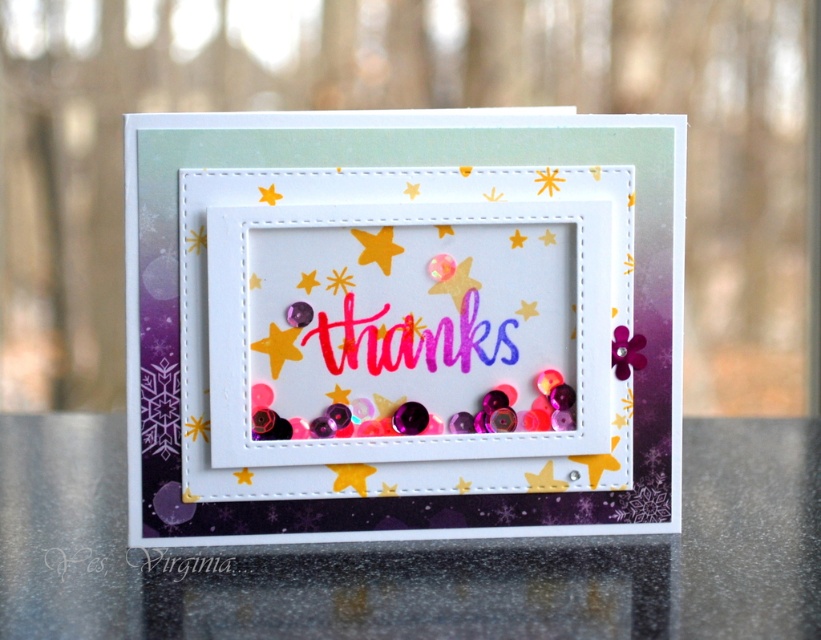
Question: Is shiny metallic table at center closer to camera compared to metallic gold star at center?

Choices:
 (A) no
 (B) yes

Answer: (B)

Question: Which object appears closest to the camera in this image?

Choices:
 (A) white paper at center
 (B) shiny metallic table at center

Answer: (B)

Question: Based on their relative distances, which object is farther from the white paper at center?

Choices:
 (A) metallic gold star at center
 (B) shiny metallic table at center

Answer: (B)

Question: Based on their relative distances, which object is farther from the metallic gold star at center?

Choices:
 (A) shiny metallic table at center
 (B) white paper at center

Answer: (A)

Question: Can you confirm if white paper at center is smaller than shiny metallic table at center?

Choices:
 (A) yes
 (B) no

Answer: (A)

Question: Does white paper at center have a greater width compared to metallic gold star at center?

Choices:
 (A) yes
 (B) no

Answer: (A)